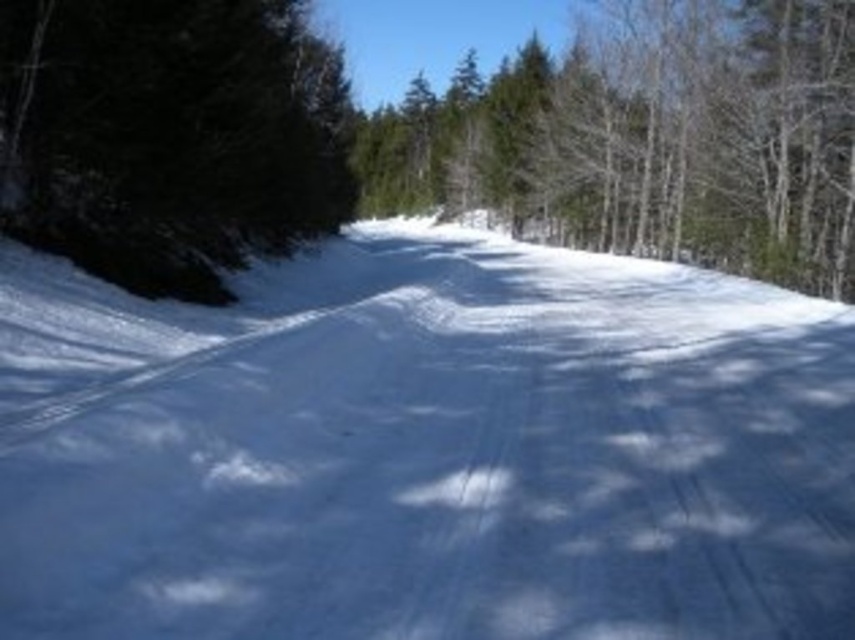
Question: Based on their relative distances, which object is farther from the dark green evergreen at left?

Choices:
 (A) white snow at center
 (B) green matte tree at center

Answer: (B)

Question: Where is white snow at center located in relation to dark green evergreen at left in the image?

Choices:
 (A) above
 (B) below

Answer: (B)

Question: Is white snow at center wider than dark green evergreen at left?

Choices:
 (A) no
 (B) yes

Answer: (B)

Question: Can you confirm if white snow at center is bigger than green matte tree at center?

Choices:
 (A) no
 (B) yes

Answer: (A)

Question: Which point appears closest to the camera in this image?

Choices:
 (A) (634, 198)
 (B) (606, 305)

Answer: (B)

Question: Based on their relative distances, which object is nearer to the dark green evergreen at left?

Choices:
 (A) green matte tree at center
 (B) white snow at center

Answer: (B)